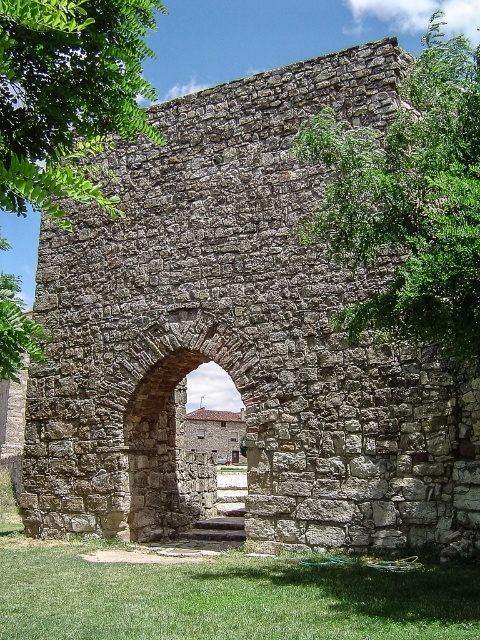
Question: Does green leafy tree at upper left have a larger size compared to green leafy tree at left?

Choices:
 (A) yes
 (B) no

Answer: (B)

Question: Is rustic stone archway at center positioned at the back of green leafy tree at left?

Choices:
 (A) no
 (B) yes

Answer: (B)

Question: Considering the real-world distances, which object is farthest from the rustic stone archway at center?

Choices:
 (A) green leafy tree at upper right
 (B) green leafy tree at left
 (C) green grass at lower center

Answer: (A)

Question: Is the position of green leafy tree at upper left more distant than that of green leafy tree at left?

Choices:
 (A) yes
 (B) no

Answer: (B)

Question: Which point is closer to the camera taking this photo?

Choices:
 (A) (204, 618)
 (B) (468, 353)
 (C) (73, 176)
 (D) (38, 332)

Answer: (C)

Question: Which is nearer to the rustic stone archway at center?

Choices:
 (A) green leafy tree at left
 (B) green grass at lower center
 (C) green leafy tree at upper left
 (D) green leafy tree at upper right

Answer: (B)